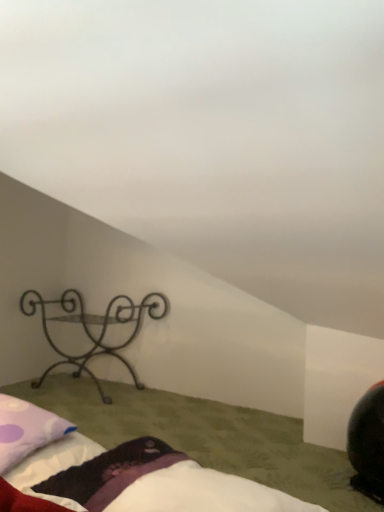
Question: Is fluffy white bed at lower center to the right of purple dotted pillow at lower left from the viewer's perspective?

Choices:
 (A) no
 (B) yes

Answer: (B)

Question: Does fluffy white bed at lower center appear on the left side of purple dotted pillow at lower left?

Choices:
 (A) no
 (B) yes

Answer: (A)

Question: Is fluffy white bed at lower center positioned before purple dotted pillow at lower left?

Choices:
 (A) yes
 (B) no

Answer: (A)

Question: Would you say fluffy white bed at lower center is a long distance from purple dotted pillow at lower left?

Choices:
 (A) no
 (B) yes

Answer: (A)

Question: Can you confirm if fluffy white bed at lower center is wider than purple dotted pillow at lower left?

Choices:
 (A) yes
 (B) no

Answer: (A)

Question: Considering the relative positions of fluffy white bed at lower center and purple dotted pillow at lower left in the image provided, is fluffy white bed at lower center behind purple dotted pillow at lower left?

Choices:
 (A) no
 (B) yes

Answer: (A)

Question: Is purple dotted pillow at lower left thinner than fluffy white bed at lower center?

Choices:
 (A) yes
 (B) no

Answer: (A)

Question: Is purple dotted pillow at lower left taller than fluffy white bed at lower center?

Choices:
 (A) no
 (B) yes

Answer: (B)

Question: Considering the relative sizes of purple dotted pillow at lower left and fluffy white bed at lower center in the image provided, is purple dotted pillow at lower left shorter than fluffy white bed at lower center?

Choices:
 (A) no
 (B) yes

Answer: (A)

Question: Is purple dotted pillow at lower left facing away from fluffy white bed at lower center?

Choices:
 (A) no
 (B) yes

Answer: (A)

Question: Considering the relative sizes of purple dotted pillow at lower left and fluffy white bed at lower center in the image provided, is purple dotted pillow at lower left bigger than fluffy white bed at lower center?

Choices:
 (A) yes
 (B) no

Answer: (B)

Question: Does purple dotted pillow at lower left lie in front of fluffy white bed at lower center?

Choices:
 (A) no
 (B) yes

Answer: (A)

Question: From the image's perspective, is black wrought iron shelf at left under purple dotted pillow at lower left?

Choices:
 (A) yes
 (B) no

Answer: (A)